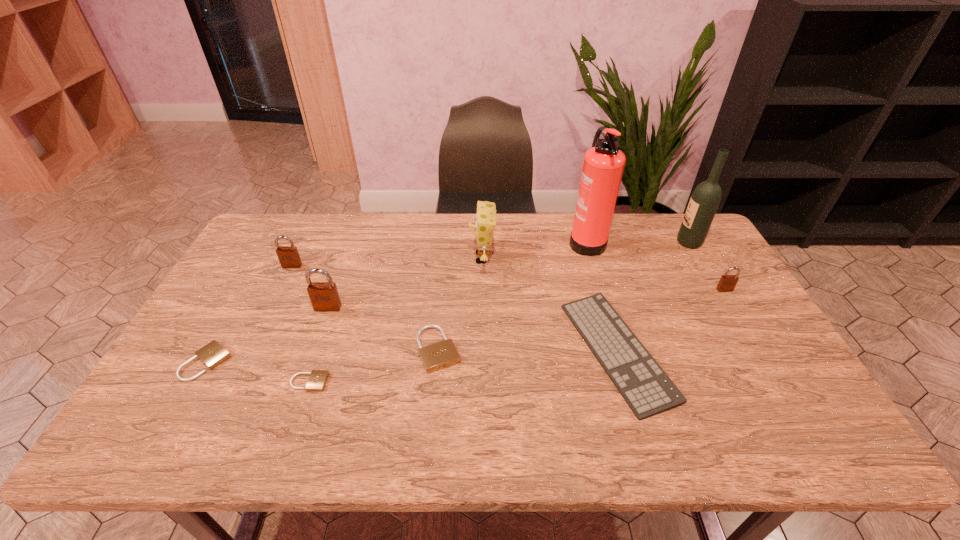
At what (x,y) coordinates should I click in order to perform the action: click on the second farthest brown padlock. Please return your answer as a coordinate pair (x, y). Looking at the image, I should click on (727, 283).

The image size is (960, 540). What are the coordinates of `the fifth farthest object` in the screenshot? It's located at (727, 283).

Locate an element on the screen. the second padlock from right to left is located at coordinates (442, 354).

Where is `the third shortest padlock`? This screenshot has height=540, width=960. the third shortest padlock is located at coordinates (442, 354).

Locate an element on the screen. The image size is (960, 540). computer keyboard is located at coordinates (646, 388).

The height and width of the screenshot is (540, 960). I want to click on the leftmost beige padlock, so click(x=212, y=354).

The width and height of the screenshot is (960, 540). I want to click on the leftmost object, so click(212, 354).

Find the location of a particular element. the shortest padlock is located at coordinates (317, 380).

Where is `the smallest beige padlock`? the smallest beige padlock is located at coordinates [x=317, y=380].

Identify the location of free space located 0.380m at the nozzle of the tallest object. (459, 240).